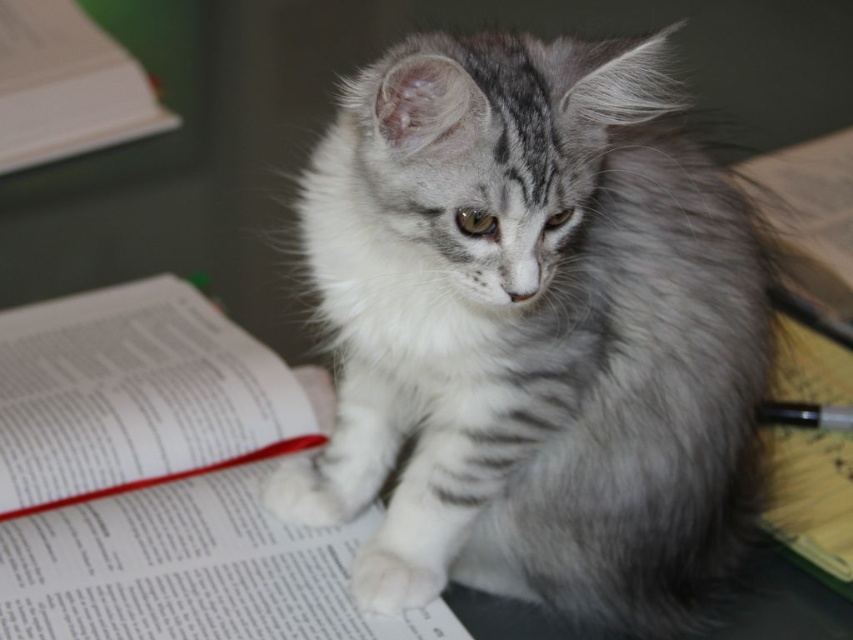
You are organizing books on a desk and see the white paper book at center and the white paper book at upper left. Which one is located to the right of the other?

The white paper book at center is positioned on the right side of the white paper book at upper left, so the white paper book at center is to the right of the white paper book at upper left.

You are a student who needs to place a yellow paper notebook at lower right on your desk. Where should you place it according to the image?

According to the image, the yellow paper notebook at lower right is located at point coordinates of 0.689 in the x axis and 0.951 in the y axis.

You are looking at the image and notice two points marked in the scene. The first point is at coordinate point(132,435) and the second is at point(149,125). Which of these two points is closer to you, the observer?

Point(132,435) is closer to the camera than point(149,125).